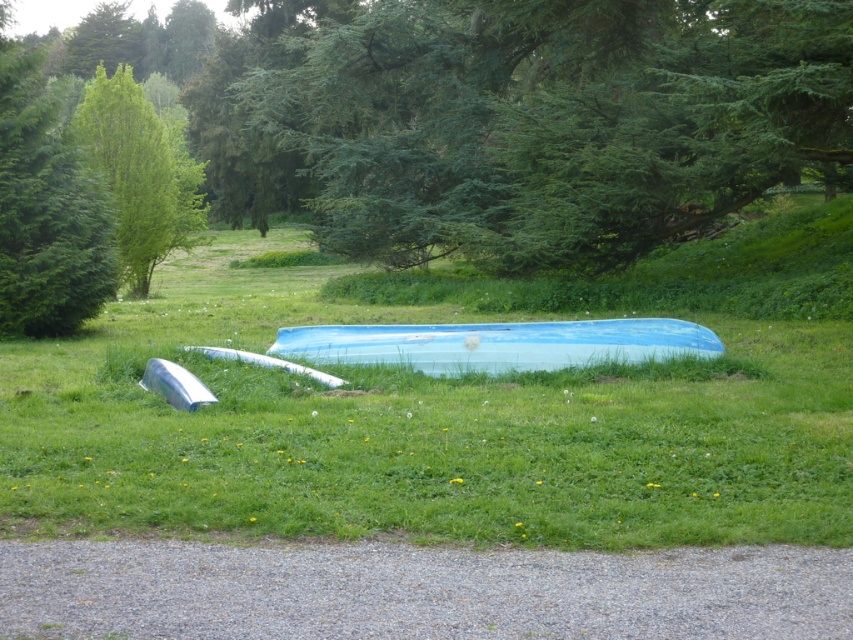
Question: Is the position of green grassy field at center less distant than that of light blue plastic boat at center?

Choices:
 (A) yes
 (B) no

Answer: (A)

Question: Which object is the closest to the green leafy tree at upper left?

Choices:
 (A) green textured tree at upper center
 (B) light blue plastic boat at center
 (C) green grassy field at center

Answer: (C)

Question: Which point is closer to the camera taking this photo?

Choices:
 (A) (570, 24)
 (B) (177, 179)
 (C) (469, 339)
 (D) (759, 419)

Answer: (D)

Question: Does green grassy field at center appear on the right side of light blue plastic boat at center?

Choices:
 (A) no
 (B) yes

Answer: (A)

Question: Is green grassy field at center smaller than light blue plastic boat at center?

Choices:
 (A) yes
 (B) no

Answer: (B)

Question: Among these objects, which one is nearest to the camera?

Choices:
 (A) light blue plastic boat at center
 (B) green leafy tree at left

Answer: (A)